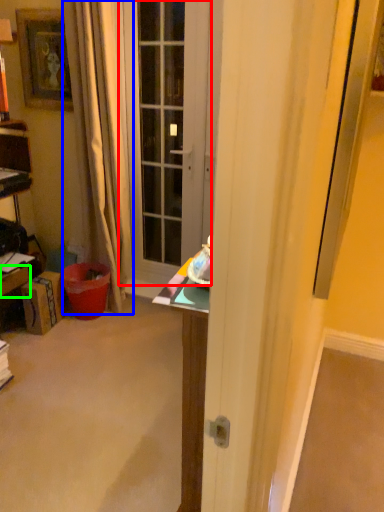
Question: Estimate the real-world distances between objects in this image. Which object is farther from door (highlighted by a red box), curtain (highlighted by a blue box) or drawer (highlighted by a green box)?

Choices:
 (A) curtain
 (B) drawer

Answer: (B)